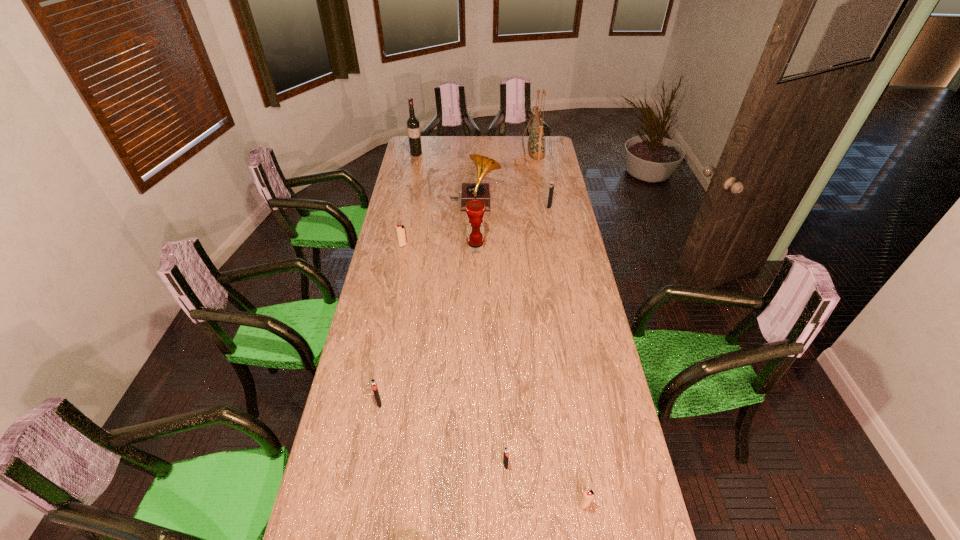
This screenshot has width=960, height=540. What are the coordinates of `handbag at the right edge` in the screenshot? It's located at (536, 143).

In order to click on object that is at the far left corner in this screenshot , I will do (x=413, y=127).

The width and height of the screenshot is (960, 540). Find the location of `object located in the far right corner section of the desktop`. object located in the far right corner section of the desktop is located at coordinates (536, 143).

Image resolution: width=960 pixels, height=540 pixels. Identify the location of vacant space at the far edge. (456, 145).

In the image, there is a desktop. Where is `vacant space at the left edge`? Image resolution: width=960 pixels, height=540 pixels. vacant space at the left edge is located at coordinates tap(377, 468).

Identify the location of vacant space at the right edge of the desktop. The image size is (960, 540). (577, 234).

Identify the location of vacant area at the far left corner of the desktop. Image resolution: width=960 pixels, height=540 pixels. (430, 141).

I want to click on empty space between the left red igniter and the nearest object, so click(x=494, y=375).

Locate an element on the screen. The image size is (960, 540). free space between the wine bottle and the fourth igniter from left to right is located at coordinates (500, 329).

You are a GUI agent. You are given a task and a screenshot of the screen. Output one action in this format:
    pyautogui.click(x=<x>, y=<y>)
    Task: Click on the vacant space that is in between the wine bottle and the handbag
    This screenshot has width=960, height=540.
    Given the screenshot: What is the action you would take?
    pyautogui.click(x=472, y=152)